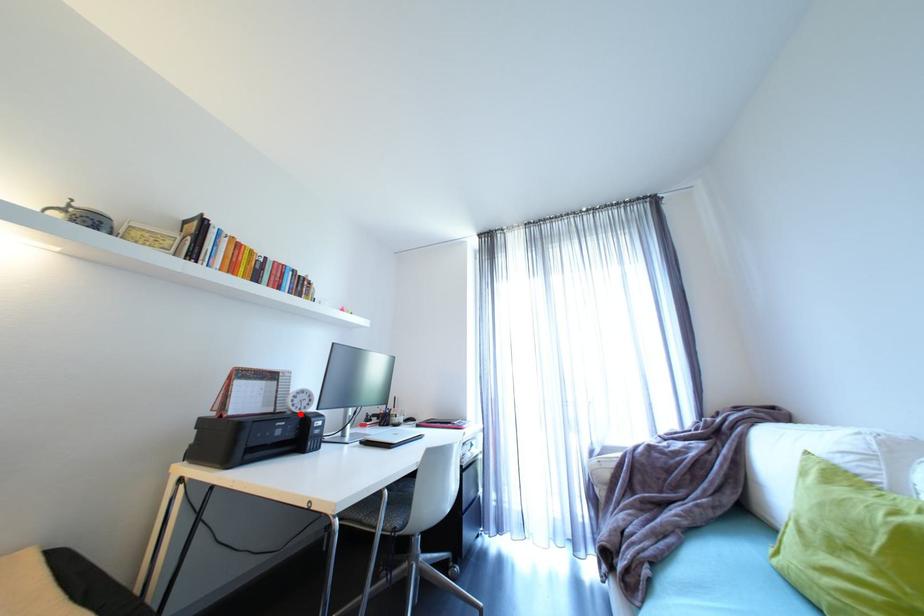
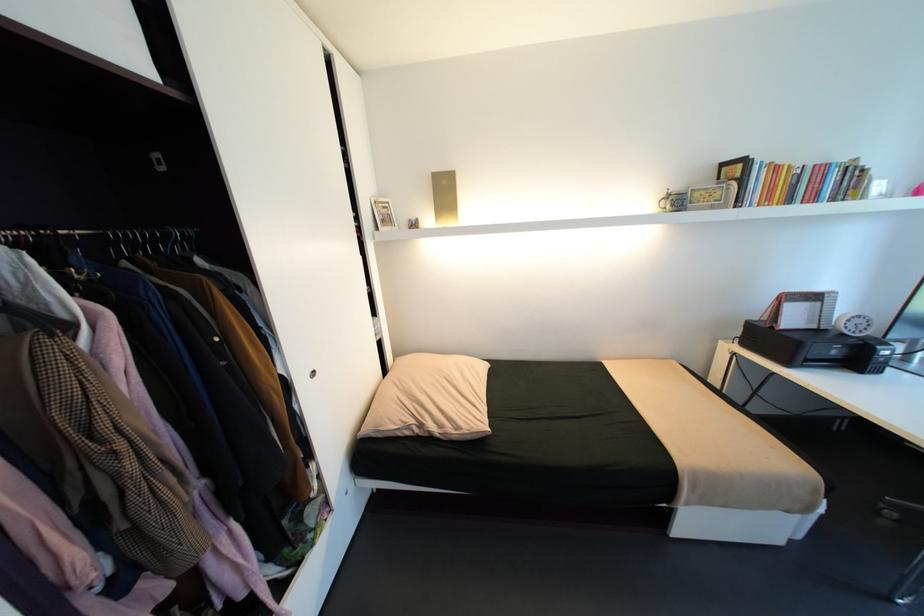
Find the pixel in the second image that matches the highlighted location in the first image.

(850, 334)